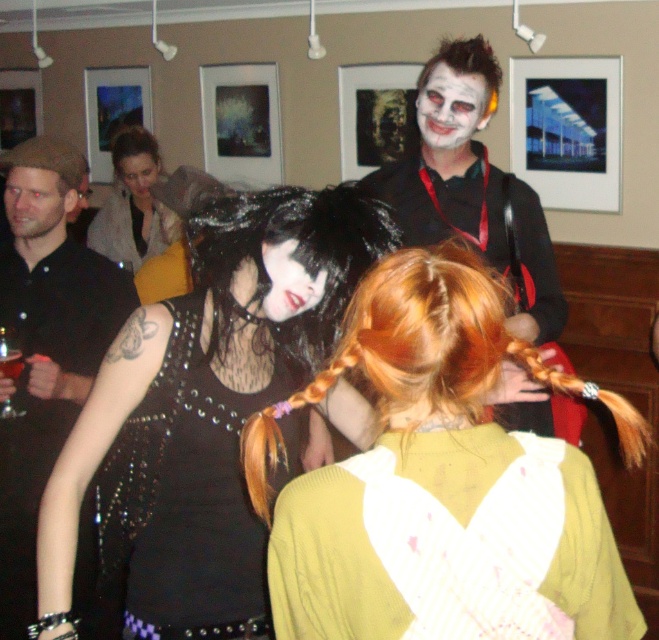
Between point (420, 284) and point (432, 196), which one is positioned in front?

Positioned in front is point (420, 284).

Is point (382, 561) more distant than point (492, 104)?

No.

Describe the element at coordinates (444, 490) in the screenshot. This screenshot has height=640, width=659. I see `shiny orange hair at center` at that location.

Where is `shiny orange hair at center`? shiny orange hair at center is located at coordinates (444, 490).

Who is positioned more to the left, matte black vest at center or metallic silver cup at center?

matte black vest at center is more to the left.

From the picture: Is matte black vest at center taller than metallic silver cup at center?

Indeed, matte black vest at center has a greater height compared to metallic silver cup at center.

This screenshot has width=659, height=640. Describe the element at coordinates (130, 204) in the screenshot. I see `matte black vest at center` at that location.

Locate an element on the screen. The width and height of the screenshot is (659, 640). matte black vest at center is located at coordinates (130, 204).

Who is taller, matte black costume at center or matte black wig at upper left?

With more height is matte black costume at center.

Between point (482, 168) and point (140, 156), which one is positioned behind?

Positioned behind is point (140, 156).

Between point (488, 115) and point (134, 157), which one is positioned in front?

Point (488, 115) is in front.

Identify the location of matte black costume at center. (473, 186).